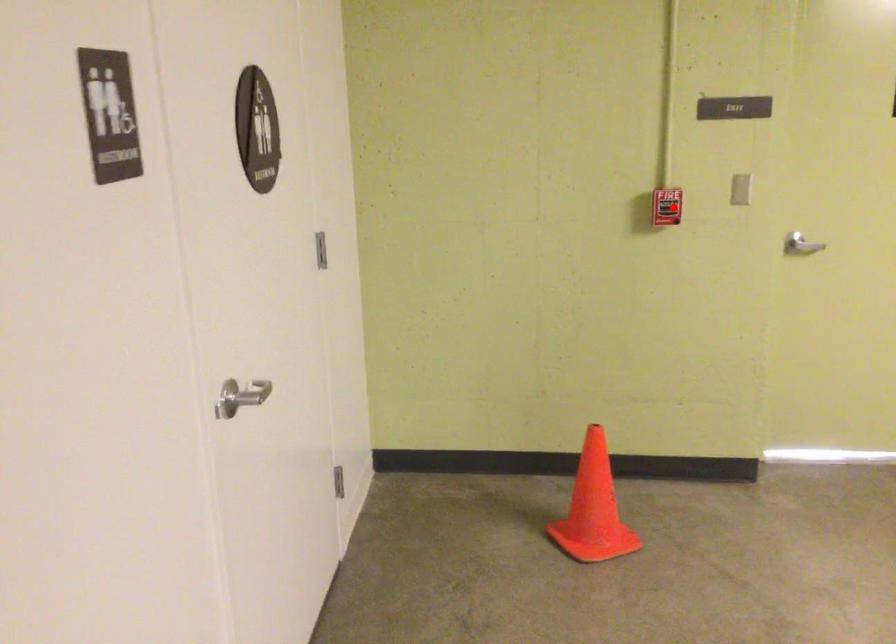
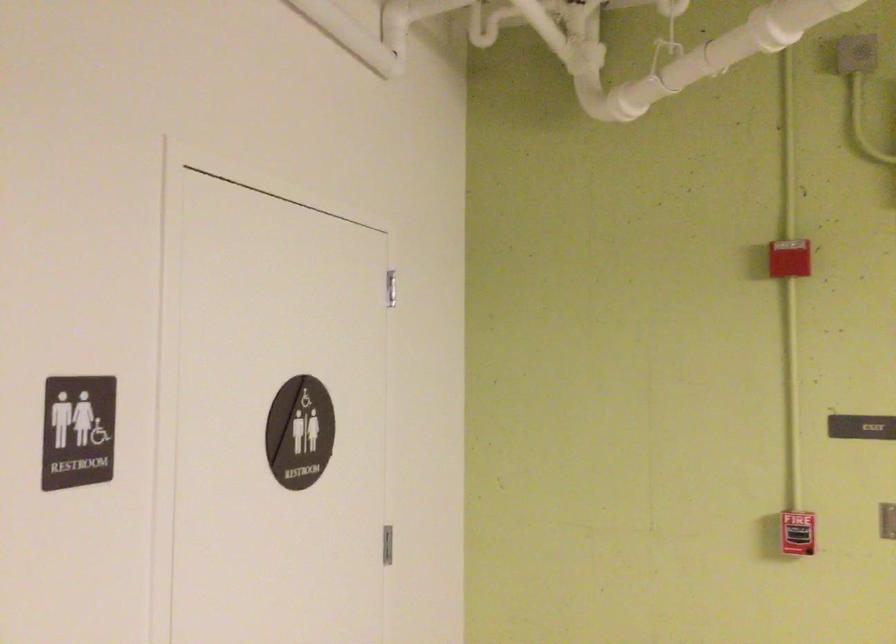
Question: I am providing you with two images of the same scene from different viewpoints. A red point is shown in image1. For the corresponding object point in image2, is it positioned nearer or farther from the camera?

Choices:
 (A) Nearer
 (B) Farther

Answer: (A)